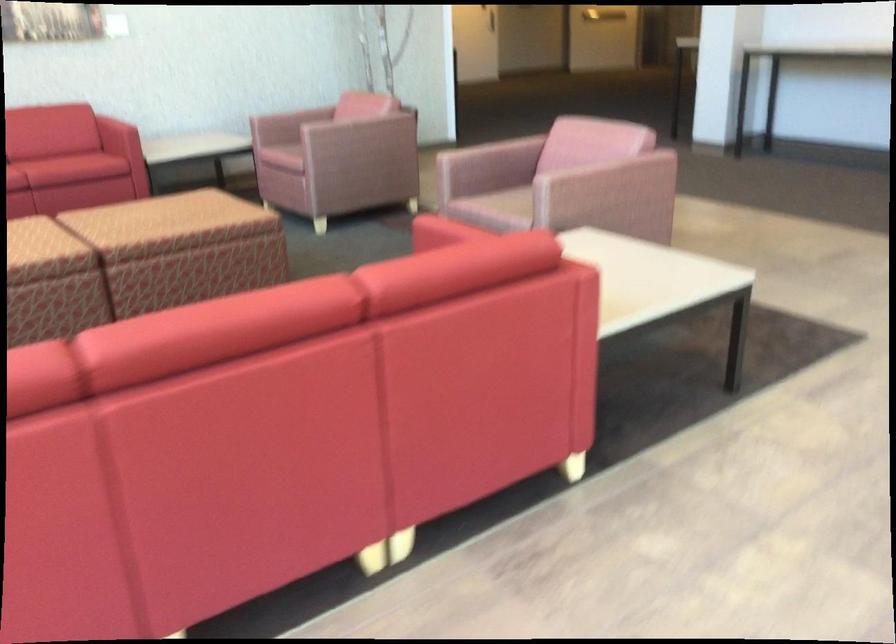
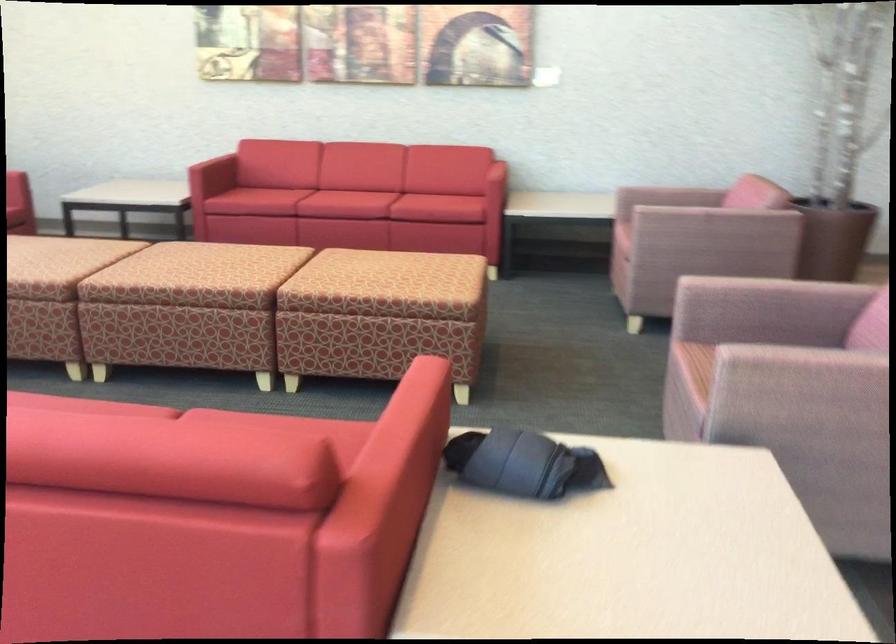
Locate, in the second image, the point that corresponds to pixel 174 207 in the first image.

(385, 270)